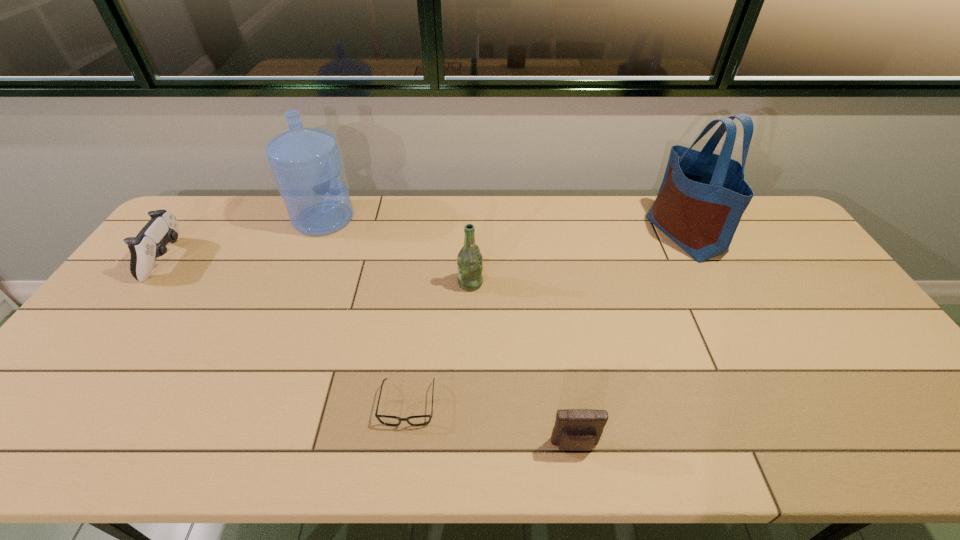
In order to click on vacant space located on the side of the water jug with the handle in this screenshot , I will do `click(434, 218)`.

I want to click on vacant space situated on the surface of the beer bottle, so click(x=543, y=283).

Locate an element on the screen. Image resolution: width=960 pixels, height=540 pixels. vacant space positioned on the front-facing side of the leftmost object is located at coordinates (228, 259).

The height and width of the screenshot is (540, 960). What are the coordinates of `vacant position located 0.050m on the front-facing side of the second nearest object` in the screenshot? It's located at (402, 450).

At what (x,y) coordinates should I click in order to perform the action: click on handbag that is at the far edge. Please return your answer as a coordinate pair (x, y). The height and width of the screenshot is (540, 960). Looking at the image, I should click on (701, 200).

The width and height of the screenshot is (960, 540). In order to click on water jug that is at the far edge in this screenshot , I will do `click(306, 162)`.

You are a GUI agent. You are given a task and a screenshot of the screen. Output one action in this format:
    pyautogui.click(x=<x>, y=<y>)
    Task: Click on the control that is at the far edge
    The height and width of the screenshot is (540, 960).
    Given the screenshot: What is the action you would take?
    pyautogui.click(x=150, y=243)

Identify the location of pouch that is positioned at the near edge. This screenshot has width=960, height=540. (575, 429).

The image size is (960, 540). I want to click on spectacles that is positioned at the near edge, so click(x=420, y=420).

Where is `object located at the left edge`? The image size is (960, 540). object located at the left edge is located at coordinates (150, 243).